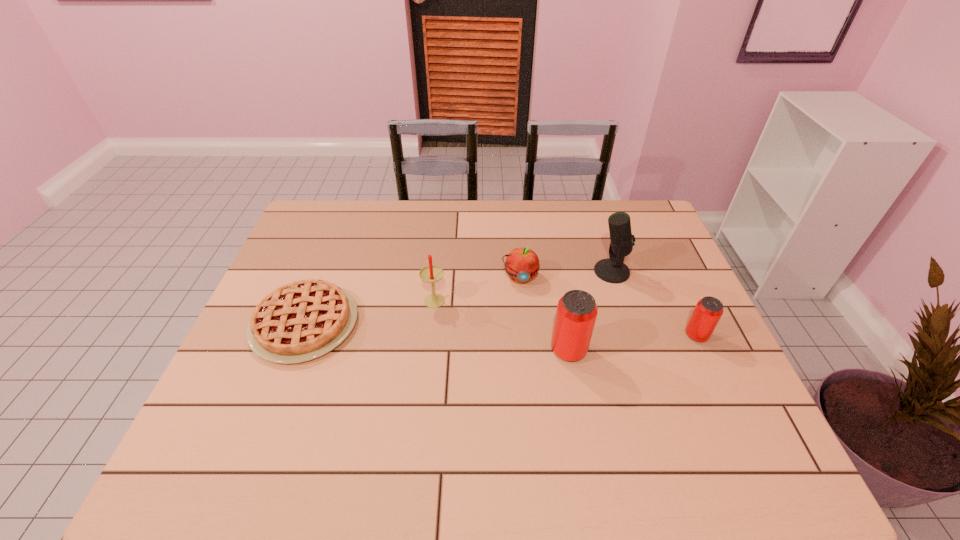
In the image, there is a desktop. Where is `vacant space at the left edge`? vacant space at the left edge is located at coordinates (320, 246).

What are the coordinates of `free space at the right edge of the desktop` in the screenshot? It's located at (644, 302).

What are the coordinates of `free region at the far left corner of the desktop` in the screenshot? It's located at (344, 227).

Image resolution: width=960 pixels, height=540 pixels. Find the location of `unoccupied position between the apple and the pie`. unoccupied position between the apple and the pie is located at coordinates (412, 300).

Image resolution: width=960 pixels, height=540 pixels. I want to click on blank region between the fourth object from right to left and the taller can, so click(x=544, y=314).

Image resolution: width=960 pixels, height=540 pixels. I want to click on vacant space in between the right can and the pie, so click(500, 329).

Locate an element on the screen. The height and width of the screenshot is (540, 960). free spot between the candle and the microphone is located at coordinates (523, 285).

At what (x,y) coordinates should I click in order to perform the action: click on free space between the apple and the fifth object from right to left. Please return your answer as a coordinate pair (x, y). This screenshot has width=960, height=540. Looking at the image, I should click on (477, 288).

Find the location of a particular element. The image size is (960, 540). empty location between the rightmost object and the second object from right to left is located at coordinates (654, 303).

What are the coordinates of `free space that is in between the third object from left to right and the shortest object` in the screenshot? It's located at (412, 300).